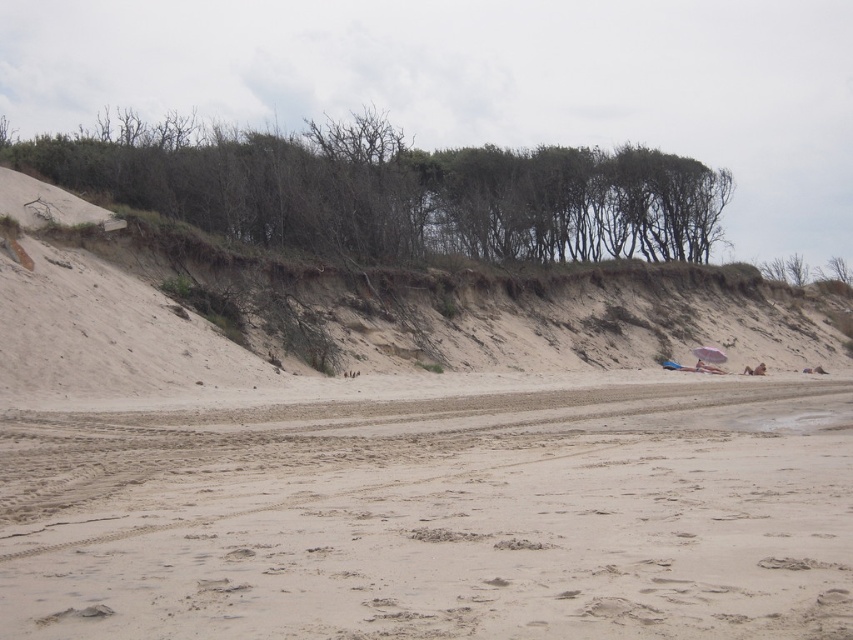
From the picture: Is light beige sand at center shorter than green leafy trees at upper center?

Yes, light beige sand at center is shorter than green leafy trees at upper center.

Can you confirm if light beige sand at center is smaller than green leafy trees at upper center?

Indeed, light beige sand at center has a smaller size compared to green leafy trees at upper center.

Who is more distant from viewer, (666, 552) or (262, 163)?

Point (262, 163)

Locate an element on the screen. This screenshot has width=853, height=640. light beige sand at center is located at coordinates (438, 516).

Is light beige sand at center above brown sandy hillside at upper center?

No.

What do you see at coordinates (438, 516) in the screenshot? This screenshot has width=853, height=640. I see `light beige sand at center` at bounding box center [438, 516].

The height and width of the screenshot is (640, 853). I want to click on light beige sand at center, so click(438, 516).

Who is positioned more to the left, brown sandy hillside at upper center or green leafy trees at upper center?

Positioned to the left is green leafy trees at upper center.

Which of these two, brown sandy hillside at upper center or green leafy trees at upper center, stands taller?

green leafy trees at upper center

The width and height of the screenshot is (853, 640). Describe the element at coordinates (370, 317) in the screenshot. I see `brown sandy hillside at upper center` at that location.

Locate an element on the screen. The height and width of the screenshot is (640, 853). brown sandy hillside at upper center is located at coordinates (370, 317).